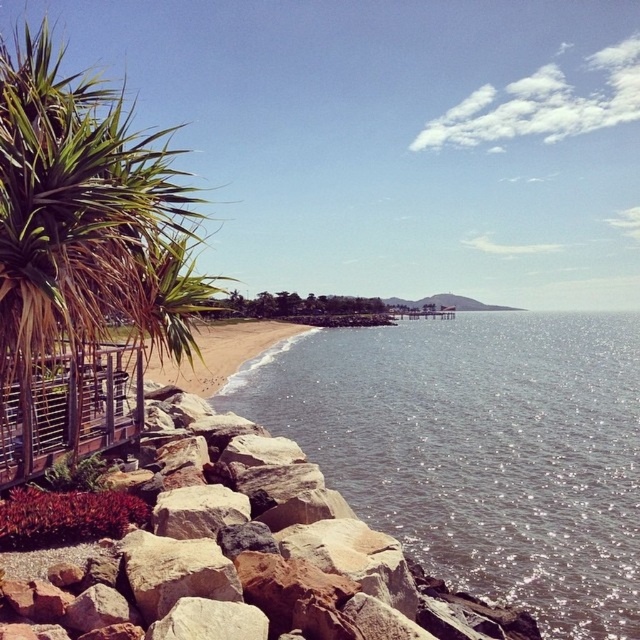
Question: Considering the relative positions of clear water at lower right and green leafy palm tree at left in the image provided, where is clear water at lower right located with respect to green leafy palm tree at left?

Choices:
 (A) right
 (B) left

Answer: (A)

Question: Which object is the closest to the beige sand at center?

Choices:
 (A) green leafy palm tree at left
 (B) clear water at lower right
 (C) brown rough rock at lower left
 (D) wooden lattice at lower left

Answer: (A)

Question: Where is green leafy palm tree at left located in relation to beige sand at center in the image?

Choices:
 (A) left
 (B) right

Answer: (A)

Question: Does clear water at lower right appear over beige sand at center?

Choices:
 (A) no
 (B) yes

Answer: (A)

Question: Among these objects, which one is nearest to the camera?

Choices:
 (A) green leafy palm tree at left
 (B) wooden lattice at lower left

Answer: (A)

Question: Which object is farther from the camera taking this photo?

Choices:
 (A) beige sand at center
 (B) wooden lattice at lower left
 (C) green leafy palm tree at left

Answer: (B)